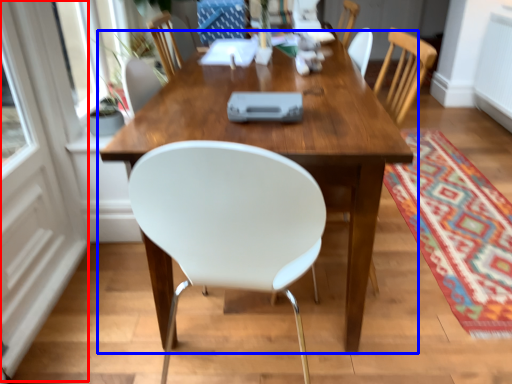
Question: Which point is further to the camera, screen door (highlighted by a red box) or table (highlighted by a blue box)?

Choices:
 (A) screen door
 (B) table

Answer: (B)